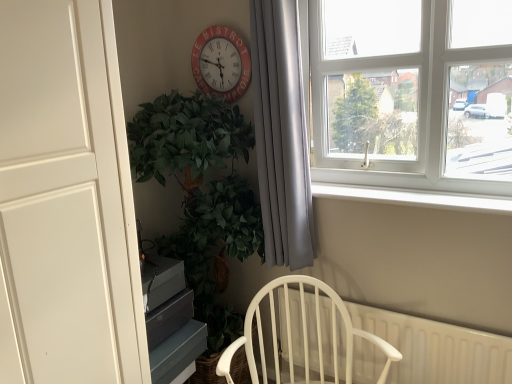
Question: Is point (475, 339) closer or farther from the camera than point (421, 102)?

Choices:
 (A) closer
 (B) farther

Answer: (A)

Question: In terms of size, does white plastic radiator at lower right appear bigger or smaller than white plastic window at upper right?

Choices:
 (A) big
 (B) small

Answer: (B)

Question: Which of these objects is positioned closest to the white plastic window at upper right?

Choices:
 (A) white smooth window sill at upper right
 (B) green leafy plant at left
 (C) matte red clock at upper center
 (D) white plastic radiator at lower right
 (E) white wood chair at lower center

Answer: (A)

Question: Which object is the closest to the white wood chair at lower center?

Choices:
 (A) green leafy plant at left
 (B) white plastic radiator at lower right
 (C) white matte door at left
 (D) white smooth window sill at upper right
 (E) matte red clock at upper center

Answer: (B)